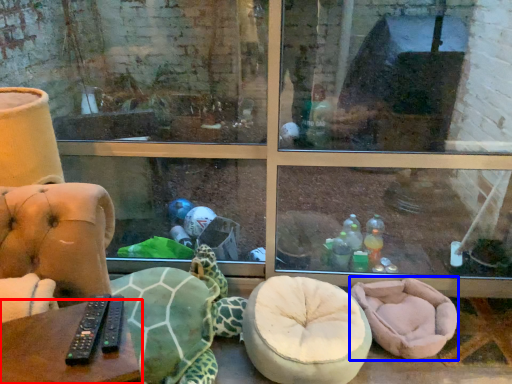
Question: Which of the following is the closest to the observer, table (highlighted by a red box) or bean bag chair (highlighted by a blue box)?

Choices:
 (A) table
 (B) bean bag chair

Answer: (A)